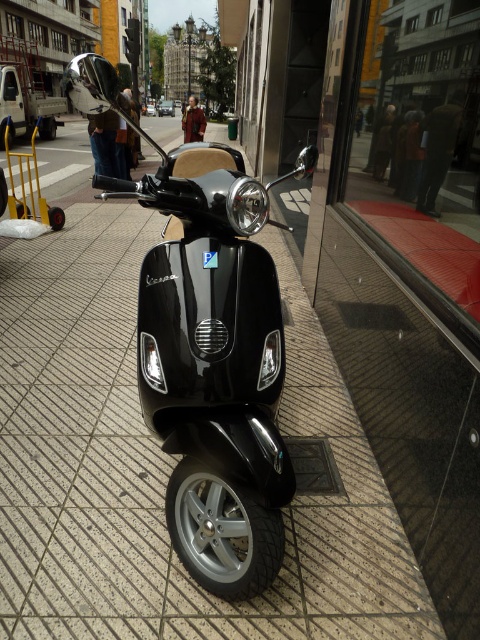
Question: Where is glossy black scooter at center located in relation to red glass window at center in the image?

Choices:
 (A) right
 (B) left

Answer: (B)

Question: Which of the following is the farthest from the observer?

Choices:
 (A) red glass window at center
 (B) glossy black scooter at center

Answer: (A)

Question: Which point appears closest to the camera in this image?

Choices:
 (A) (181, 344)
 (B) (479, 310)

Answer: (A)

Question: Observing the image, what is the correct spatial positioning of glossy black scooter at center in reference to red glass window at center?

Choices:
 (A) above
 (B) below

Answer: (B)

Question: Does glossy black scooter at center have a greater width compared to red glass window at center?

Choices:
 (A) no
 (B) yes

Answer: (B)